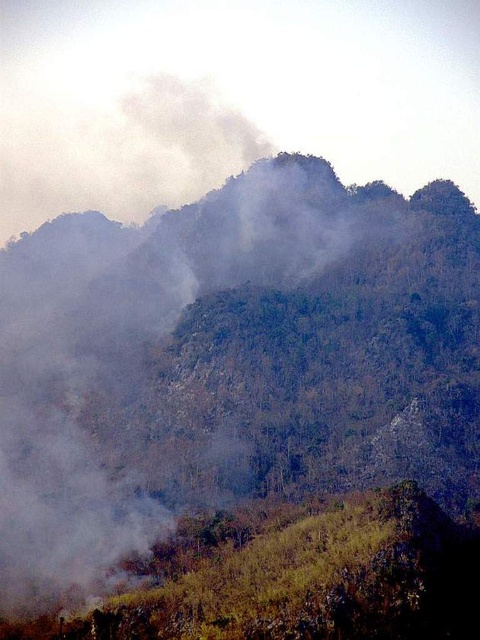
Does white smoke at center appear under white smoke at upper center?

Correct, white smoke at center is located below white smoke at upper center.

Is white smoke at center wider than white smoke at upper center?

Incorrect, white smoke at center's width does not surpass white smoke at upper center's.

Which is in front, point (78, 493) or point (156, 122)?

Point (78, 493)

Where is `white smoke at center`? The width and height of the screenshot is (480, 640). white smoke at center is located at coordinates (140, 358).